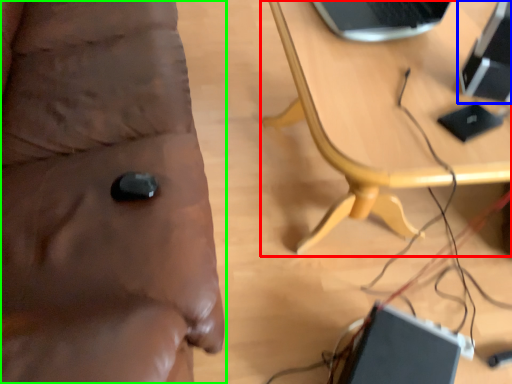
Question: Based on their relative distances, which object is farther from table (highlighted by a red box)? Choose from computer (highlighted by a blue box) and furniture (highlighted by a green box).

Choices:
 (A) computer
 (B) furniture

Answer: (B)